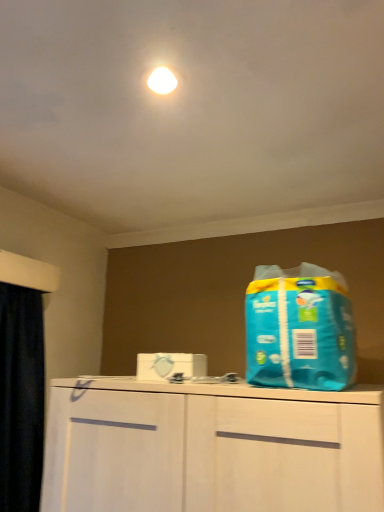
Question: Is black fabric curtain at left situated inside blue plastic bag at right or outside?

Choices:
 (A) outside
 (B) inside

Answer: (A)

Question: Would you say black fabric curtain at left is to the left or to the right of blue plastic bag at right in the picture?

Choices:
 (A) right
 (B) left

Answer: (B)

Question: Is point (1, 302) closer or farther from the camera than point (289, 381)?

Choices:
 (A) farther
 (B) closer

Answer: (A)

Question: Considering the positions of blue plastic bag at right and black fabric curtain at left in the image, is blue plastic bag at right bigger or smaller than black fabric curtain at left?

Choices:
 (A) small
 (B) big

Answer: (A)

Question: Considering their positions, is blue plastic bag at right located in front of or behind black fabric curtain at left?

Choices:
 (A) front
 (B) behind

Answer: (A)

Question: Is blue plastic bag at right wider or thinner than black fabric curtain at left?

Choices:
 (A) thin
 (B) wide

Answer: (B)

Question: From a real-world perspective, relative to black fabric curtain at left, is blue plastic bag at right vertically above or below?

Choices:
 (A) below
 (B) above

Answer: (B)